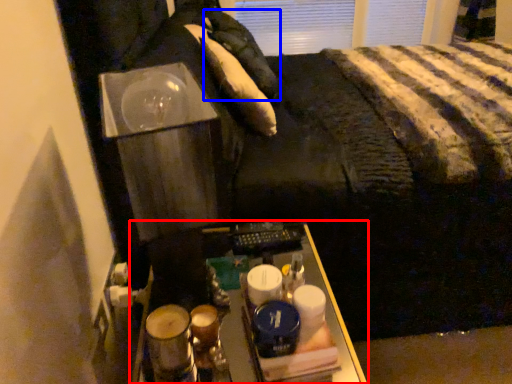
Question: Which of the following is the farthest to the observer, furniture (highlighted by a red box) or pillow (highlighted by a blue box)?

Choices:
 (A) furniture
 (B) pillow

Answer: (B)